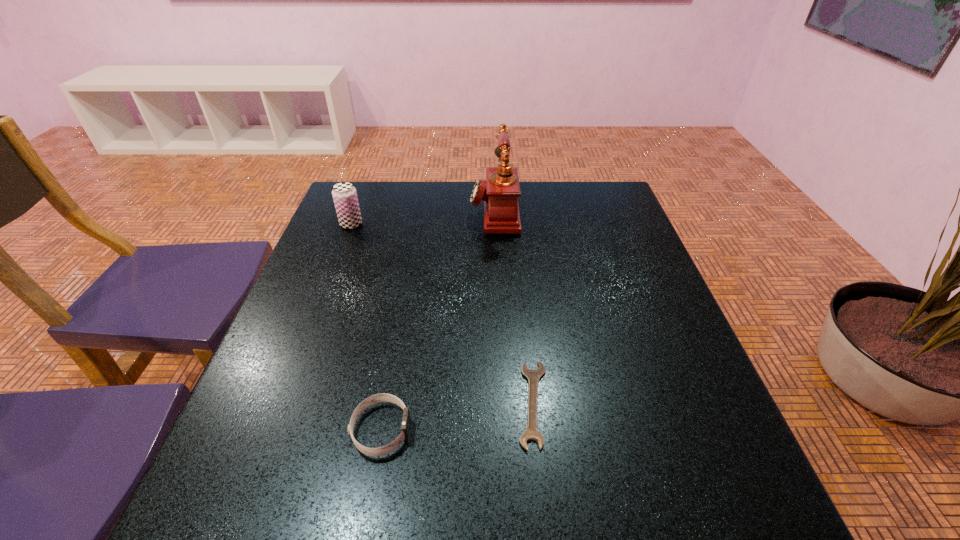
Locate an element on the screen. vacant region between the third tallest object and the telephone is located at coordinates (438, 320).

Choose which object is the third nearest neighbor to the telephone. Please provide its 2D coordinates. Your answer should be formatted as a tuple, i.e. [(x, y)], where the tuple contains the x and y coordinates of a point satisfying the conditions above.

[(383, 397)]

Locate an element on the screen. object that stands as the third closest to the wristband is located at coordinates (344, 194).

Find the location of a particular element. vacant region that satisfies the following two spatial constraints: 1. on the dial of the telephone; 2. on the front side of the third shortest object is located at coordinates (495, 224).

This screenshot has width=960, height=540. I want to click on vacant region that satisfies the following two spatial constraints: 1. on the dial of the telephone; 2. on the right side of the wrench, so click(503, 403).

You are a GUI agent. You are given a task and a screenshot of the screen. Output one action in this format:
    pyautogui.click(x=<x>, y=<y>)
    Task: Click on the vacant space that satisfies the following two spatial constraints: 1. on the front side of the beer can; 2. on the left side of the wrench
    The image size is (960, 540).
    Given the screenshot: What is the action you would take?
    pyautogui.click(x=281, y=403)